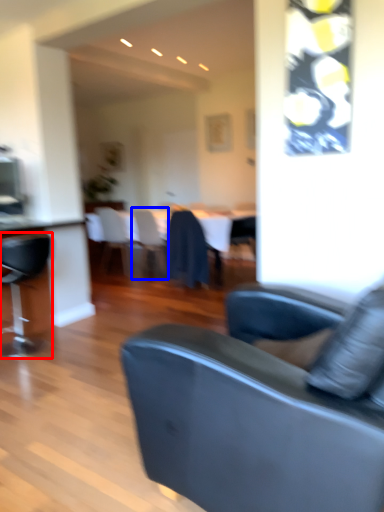
Question: Among these objects, which one is nearest to the camera, chair (highlighted by a red box) or chair (highlighted by a blue box)?

Choices:
 (A) chair
 (B) chair

Answer: (A)